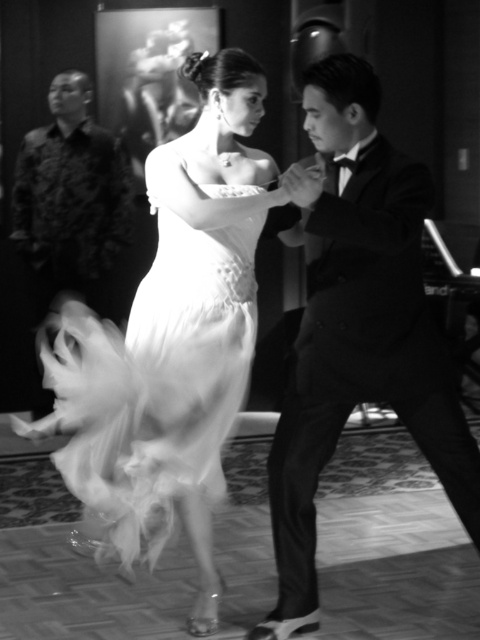
In the dance scene, you notice a shiny black suit at center and a patterned fabric shirt at left. Which one is positioned to the right side of the other?

The shiny black suit at center is positioned to the right of the patterned fabric shirt at left.

You are a photographer adjusting the focus on your camera. You want to focus on both point (213,74) and point (315,438) in the image. Which point should you focus on first to ensure the closest object is sharp?

Point (213,74) is further to the camera than point (315,438), so you should focus on point (213,74) first to ensure the closest object is sharp.